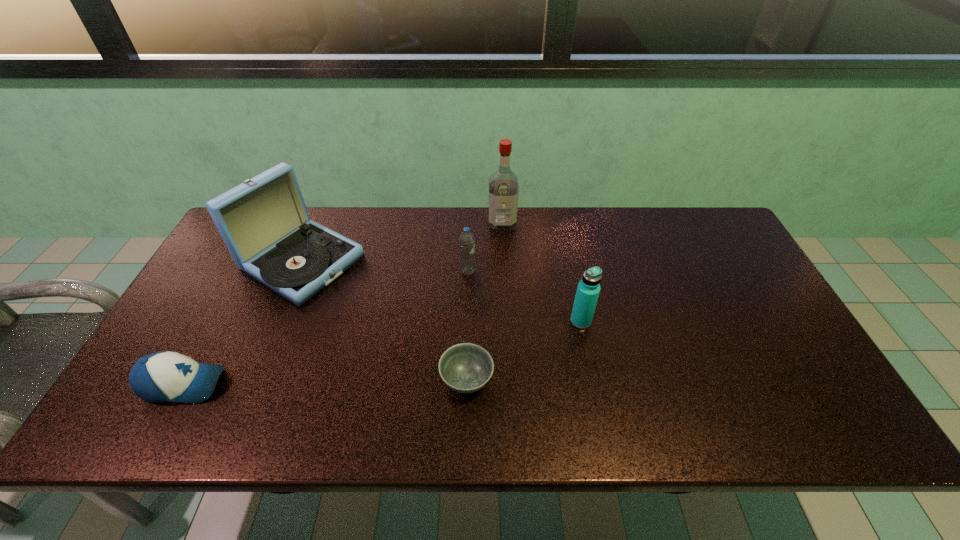
Find the location of a particular element. Image resolution: width=960 pixels, height=540 pixels. vacant area in the image that satisfies the following two spatial constraints: 1. on the front-facing side of the liquor; 2. on the right side of the third nearest object is located at coordinates (508, 321).

Locate an element on the screen. This screenshot has width=960, height=540. free location that satisfies the following two spatial constraints: 1. on the back side of the bowl; 2. on the right side of the right water bottle is located at coordinates (468, 321).

Where is `free spot that satisfies the following two spatial constraints: 1. on the front side of the phonograph record; 2. on the left side of the shortest object`? The image size is (960, 540). free spot that satisfies the following two spatial constraints: 1. on the front side of the phonograph record; 2. on the left side of the shortest object is located at coordinates (253, 380).

This screenshot has width=960, height=540. Identify the location of vacant area that satisfies the following two spatial constraints: 1. on the front-facing side of the rightmost object; 2. on the left side of the tallest object. (508, 321).